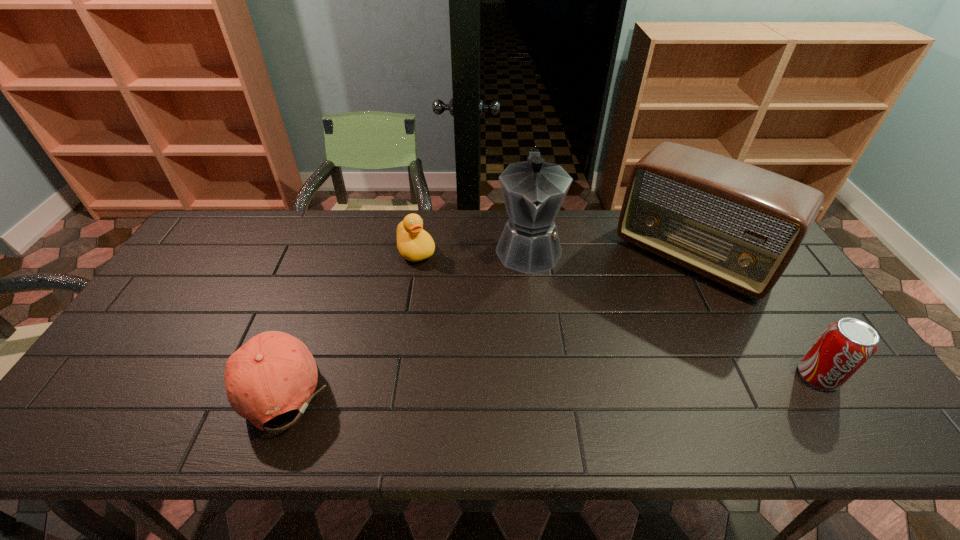
At what (x,y) coordinates should I click in order to perform the action: click on vacant area between the duck and the third object from left to right. Please return your answer as a coordinate pair (x, y). Image resolution: width=960 pixels, height=540 pixels. Looking at the image, I should click on (472, 249).

Identify which object is located as the third nearest to the third object from right to left. Please provide its 2D coordinates. Your answer should be formatted as a tuple, i.e. [(x, y)], where the tuple contains the x and y coordinates of a point satisfying the conditions above.

[(274, 372)]

I want to click on object that stands as the closest to the soda can, so click(740, 225).

You are a GUI agent. You are given a task and a screenshot of the screen. Output one action in this format:
    pyautogui.click(x=<x>, y=<y>)
    Task: Click on the vacant point that satisfies the following two spatial constraints: 1. on the back side of the duck; 2. on the left side of the third object from right to left
    The image size is (960, 540).
    Given the screenshot: What is the action you would take?
    pyautogui.click(x=417, y=248)